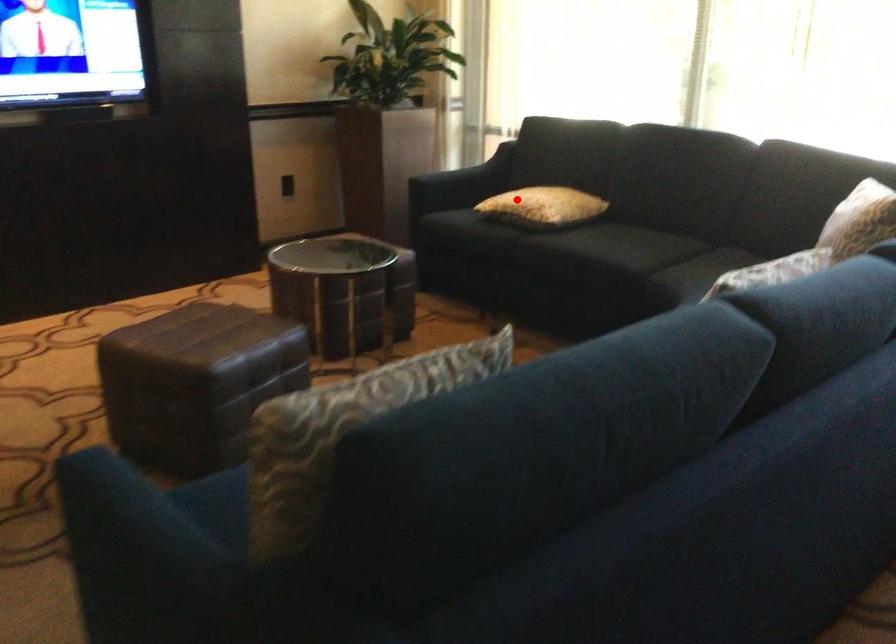
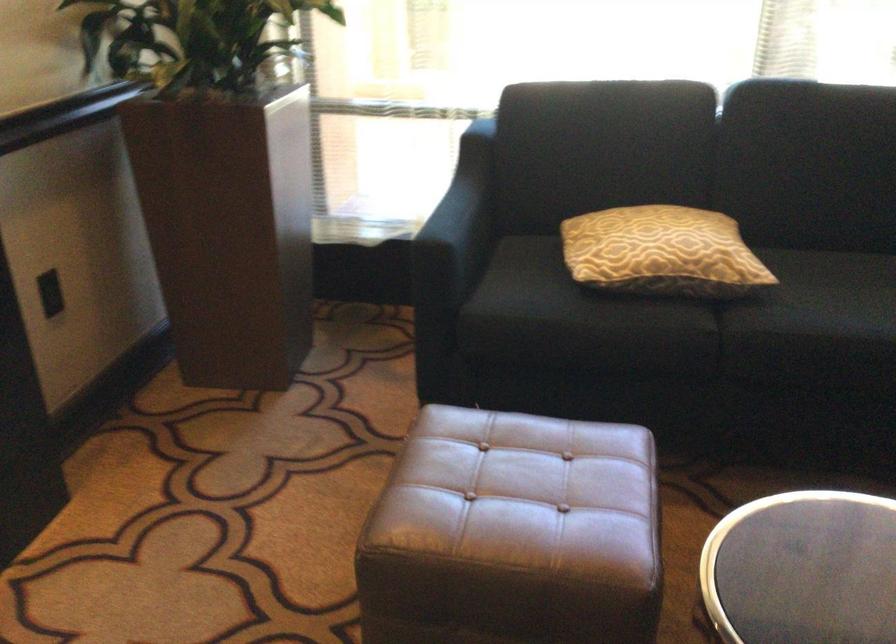
Where in the second image is the point corresponding to the highlighted location from the first image?

(661, 252)